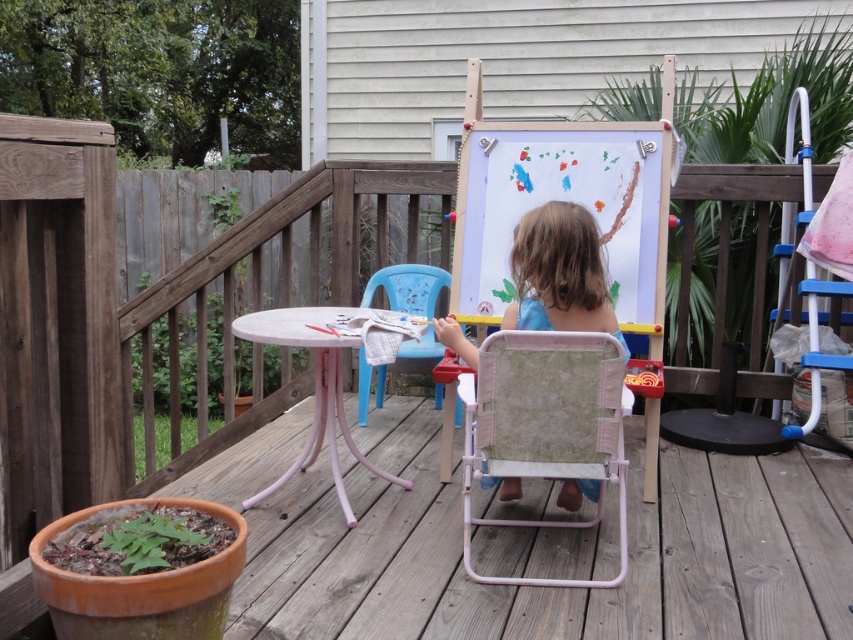
You are setting up a small art corner for a child on the wooden deck. You have a pink fabric chair at center and a blue plastic chair at center. Which chair should you choose to ensure it fits comfortably under the round table with light gray surface and pink legs?

The pink fabric chair at center has a smaller size compared to the blue plastic chair at center, so it would fit better under the round table with light gray surface and pink legs.

You are a photographer setting up a shoot on the deck. You want to place a new prop between the pink fabric chair at center and the blue cotton shirt at center. Where should you place it to ensure it is between them?

The pink fabric chair at center is positioned on the right side of blue cotton shirt at center, so placing the prop to the left of the pink fabric chair at center and to the right of the blue cotton shirt at center would place it between them.